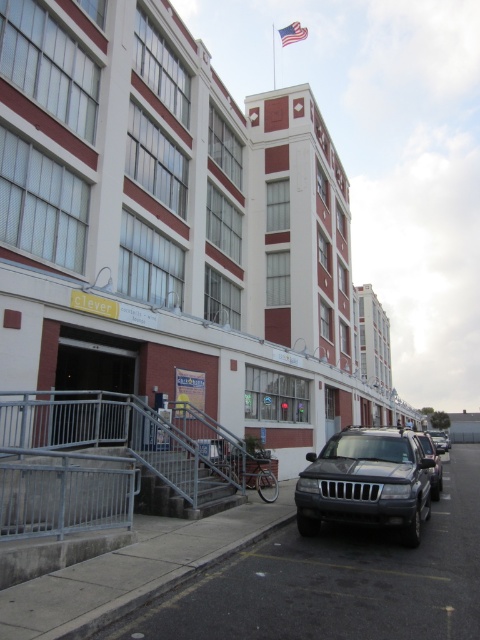
Can you confirm if satin black suv at lower center is thinner than matte silver suv at center?

Incorrect, satin black suv at lower center's width is not less than matte silver suv at center's.

Can you confirm if satin black suv at lower center is positioned to the left of matte silver suv at center?

Indeed, satin black suv at lower center is positioned on the left side of matte silver suv at center.

What are the coordinates of `satin black suv at lower center` in the screenshot? It's located at pyautogui.click(x=367, y=481).

Does point (425, 433) come closer to viewer compared to point (442, 442)?

No, it is behind (442, 442).

Does matte silver suv at center have a greater height compared to satin silver suv at center?

In fact, matte silver suv at center may be shorter than satin silver suv at center.

You are a GUI agent. You are given a task and a screenshot of the screen. Output one action in this format:
    pyautogui.click(x=<x>, y=<y>)
    Task: Click on the matte silver suv at center
    The height and width of the screenshot is (640, 480).
    Given the screenshot: What is the action you would take?
    pyautogui.click(x=433, y=464)

Is matte white building at center to the right of satin black suv at lower center from the viewer's perspective?

Indeed, matte white building at center is positioned on the right side of satin black suv at lower center.

Does point (40, 131) come in front of point (368, 456)?

No, (40, 131) is behind (368, 456).

What are the coordinates of `matte white building at center` in the screenshot? It's located at (177, 230).